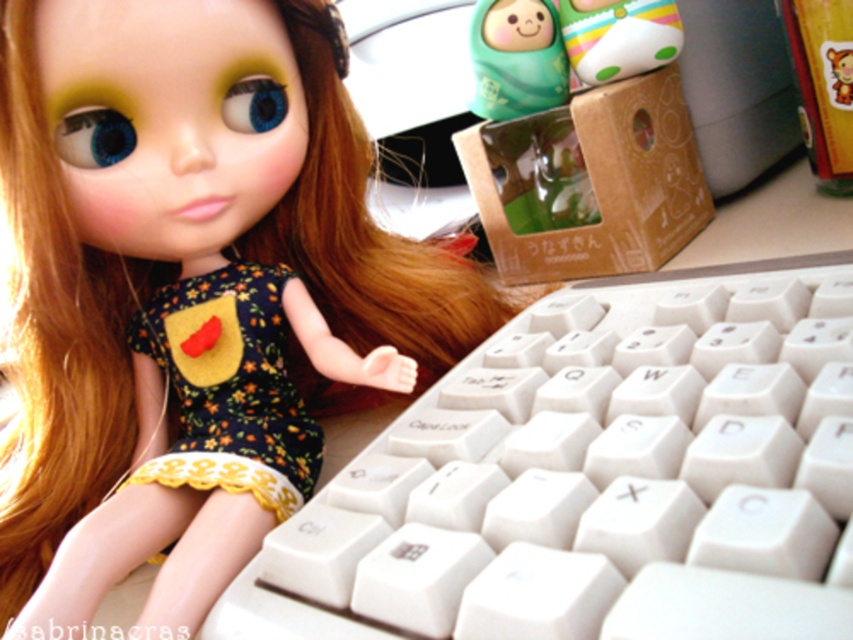
You are organizing a small display and need to place the floral fabric dress at center and the matte plastic toy at upper center. According to the scene, which object is located to the left of the other?

The floral fabric dress at center is positioned on the left side of matte plastic toy at upper center.

You are setting up a small display for a craft fair and have the floral fabric dress at center and the matte plastic toy at upper center. Which object is placed higher in the arrangement?

The matte plastic toy at upper center is placed higher than the floral fabric dress at center, as it is positioned above it.

In the scene shown: You are trying to place both the matte black doll at upper left and the matte plastic toy at upper center into a rectangular box. Which object requires more horizontal space to fit properly?

The matte black doll at upper left requires more horizontal space because its width surpasses that of the matte plastic toy at upper center.